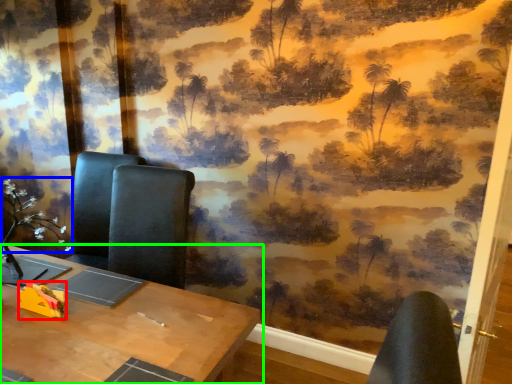
Question: Which object is the farthest from toy (highlighted by a red box)? Choose among these: flower (highlighted by a blue box) or table (highlighted by a green box).

Choices:
 (A) flower
 (B) table

Answer: (A)